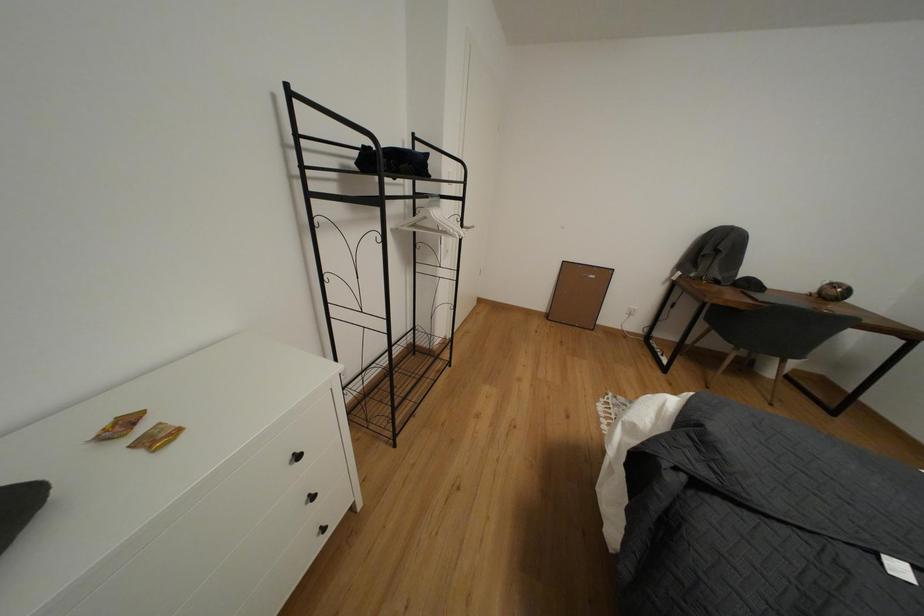
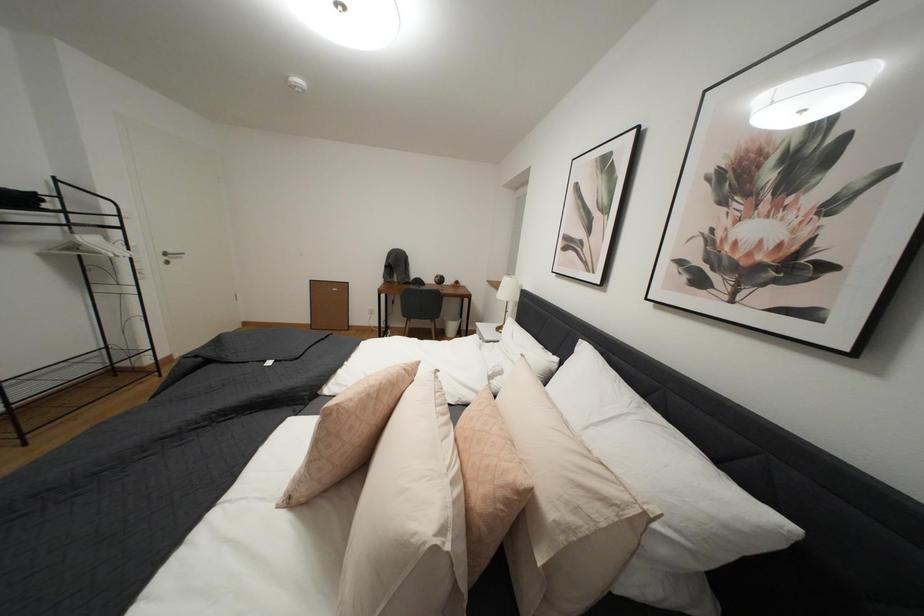
In a continuous first-person perspective shot, in which direction is the camera moving?

The cameraman moved toward right, backward.